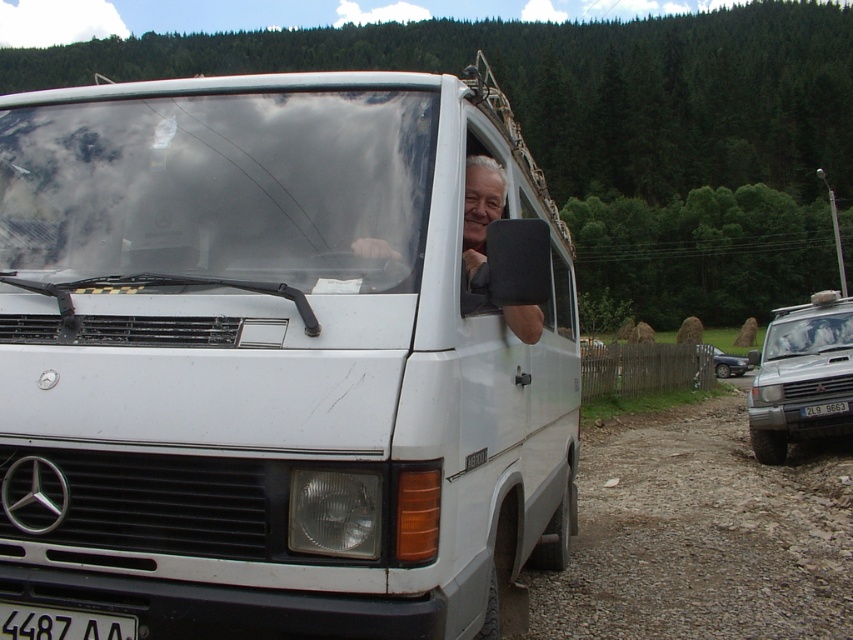
Does black plastic license plate at lower center appear under black plastic license plate at center?

Actually, black plastic license plate at lower center is above black plastic license plate at center.

Does point (6, 608) come farther from viewer compared to point (820, 403)?

No, (6, 608) is in front of (820, 403).

I want to click on black plastic license plate at lower center, so click(61, 624).

Does silver metallic suv at right have a greater width compared to metallic silver sedan at right?

Correct, the width of silver metallic suv at right exceeds that of metallic silver sedan at right.

Who is taller, silver metallic suv at right or metallic silver sedan at right?

Standing taller between the two is silver metallic suv at right.

Identify the location of silver metallic suv at right. This screenshot has width=853, height=640. (801, 374).

Is silver metallic suv at right thinner than black plastic license plate at lower center?

No, silver metallic suv at right is not thinner than black plastic license plate at lower center.

Is silver metallic suv at right positioned at the back of black plastic license plate at lower center?

Yes, it is.

The height and width of the screenshot is (640, 853). Identify the location of silver metallic suv at right. [801, 374].